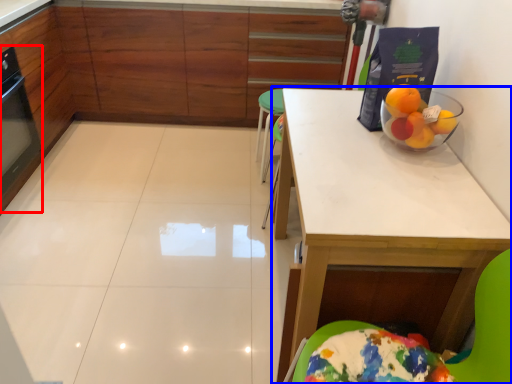
Question: Which point is closer to the camera, appliance (highlighted by a red box) or table (highlighted by a blue box)?

Choices:
 (A) appliance
 (B) table

Answer: (B)